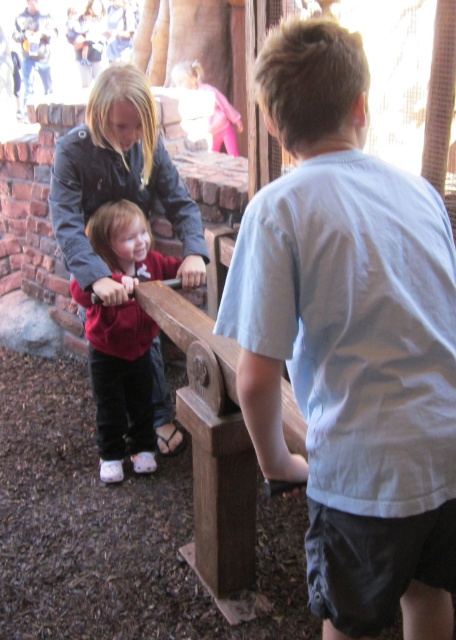
You are a photographer trying to capture a photo of both the white cotton shirt at center and the matte red shirt at center in the same frame. Based on their positions, which shirt should you focus on first to ensure both are in the frame?

Since the white cotton shirt at center is to the right of the matte red shirt at center, you should focus on the matte red shirt at center first to ensure both are captured in the frame.

You are a photographer standing at the front of the wooden park bench at center and the matte red shirt at center. Which object should you focus on first to ensure it appears larger in your photo?

The wooden park bench at center should be focused on first because it is closer to the viewer than the matte red shirt at center, making it appear larger in the photo.